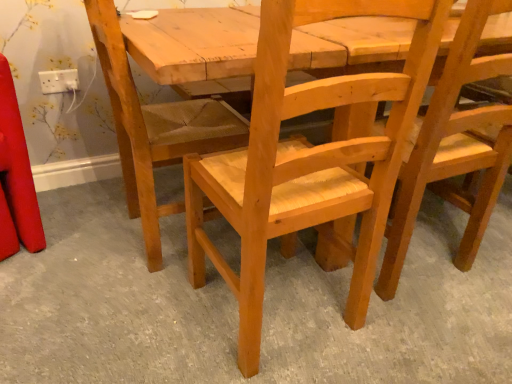
Image resolution: width=512 pixels, height=384 pixels. I want to click on natural wood chair at center, which is the second chair in right-to-left order, so click(x=308, y=161).

The image size is (512, 384). What do you see at coordinates (237, 307) in the screenshot? I see `natural wood chair at center` at bounding box center [237, 307].

Where is `natural wood chair at center, which ranks as the third chair in left-to-right order`? natural wood chair at center, which ranks as the third chair in left-to-right order is located at coordinates (453, 149).

Would you say white plastic socket at upper left is a long distance from natural wood chair at center, which ranks as the third chair in left-to-right order?

Absolutely, white plastic socket at upper left is distant from natural wood chair at center, which ranks as the third chair in left-to-right order.

Can you confirm if white plastic socket at upper left is bigger than natural wood chair at center, the 1th chair viewed from the right?

No.

Considering the positions of objects white plastic socket at upper left and natural wood chair at center, which ranks as the third chair in left-to-right order, in the image provided, who is more to the right, white plastic socket at upper left or natural wood chair at center, which ranks as the third chair in left-to-right order,?

Positioned to the right is natural wood chair at center, which ranks as the third chair in left-to-right order.

Which point is more distant from viewer, (74, 72) or (421, 127)?

The point (74, 72) is behind.

Can you confirm if natural wood chair at center, marked as the 1th chair in a left-to-right arrangement, is bigger than white plastic socket at upper left?

Indeed, natural wood chair at center, marked as the 1th chair in a left-to-right arrangement, has a larger size compared to white plastic socket at upper left.

Is white plastic socket at upper left at the back of natural wood chair at center, marked as the 1th chair in a left-to-right arrangement?

No, natural wood chair at center, marked as the 1th chair in a left-to-right arrangement,'s orientation is not away from white plastic socket at upper left.

Does point (167, 213) come closer to viewer compared to point (77, 76)?

Yes, it is.

Is white plastic socket at upper left bigger or smaller than natural wood chair at center, the second chair when ordered from left to right?

white plastic socket at upper left is smaller than natural wood chair at center, the second chair when ordered from left to right.

In terms of height, does white plastic socket at upper left look taller or shorter compared to natural wood chair at center, which is the second chair in right-to-left order?

In the image, white plastic socket at upper left appears to be shorter than natural wood chair at center, which is the second chair in right-to-left order.

From the image's perspective, who appears lower, white plastic socket at upper left or natural wood chair at center, the second chair when ordered from left to right?

natural wood chair at center, the second chair when ordered from left to right, appears lower in the image.

Between natural wood chair at center, which is the second chair in right-to-left order, and natural wood chair at center, which one is positioned behind?

natural wood chair at center is further from the camera.

Considering the sizes of objects natural wood chair at center, which is the second chair in right-to-left order, and natural wood chair at center in the image provided, who is smaller, natural wood chair at center, which is the second chair in right-to-left order, or natural wood chair at center?

Smaller between the two is natural wood chair at center, which is the second chair in right-to-left order.

The image size is (512, 384). I want to click on concrete behind the natural wood chair at center, which is the second chair in right-to-left order, so 237,307.

From the image's perspective, who appears lower, natural wood chair at center, the second chair when ordered from left to right, or natural wood chair at center?

natural wood chair at center, from the image's perspective.

From a real-world perspective, between natural wood chair at center, which is the second chair in right-to-left order, and natural wood chair at center, the third chair positioned from the right, who is vertically higher?

natural wood chair at center, which is the second chair in right-to-left order.

Considering the sizes of natural wood chair at center, which is the second chair in right-to-left order, and natural wood chair at center, marked as the 1th chair in a left-to-right arrangement, in the image, is natural wood chair at center, which is the second chair in right-to-left order, taller or shorter than natural wood chair at center, marked as the 1th chair in a left-to-right arrangement,?

In the image, natural wood chair at center, which is the second chair in right-to-left order, appears to be taller than natural wood chair at center, marked as the 1th chair in a left-to-right arrangement.

Does natural wood chair at center, which is the second chair in right-to-left order, touch natural wood chair at center, the third chair positioned from the right?

No.

Measure the distance between natural wood chair at center, the second chair when ordered from left to right, and natural wood chair at center, the third chair positioned from the right.

natural wood chair at center, the second chair when ordered from left to right, is 11.32 inches from natural wood chair at center, the third chair positioned from the right.

Does natural wood chair at center, the 1th chair viewed from the right, turn towards natural wood chair at center, the second chair when ordered from left to right?

No, natural wood chair at center, the 1th chair viewed from the right, is not aimed at natural wood chair at center, the second chair when ordered from left to right.

From the image's perspective, relative to natural wood chair at center, the second chair when ordered from left to right, is natural wood chair at center, which ranks as the third chair in left-to-right order, above or below?

natural wood chair at center, which ranks as the third chair in left-to-right order, is situated higher than natural wood chair at center, the second chair when ordered from left to right, in the image.

Considering the sizes of natural wood chair at center, the 1th chair viewed from the right, and natural wood chair at center, the second chair when ordered from left to right, in the image, is natural wood chair at center, the 1th chair viewed from the right, bigger or smaller than natural wood chair at center, the second chair when ordered from left to right,?

natural wood chair at center, the 1th chair viewed from the right, is smaller than natural wood chair at center, the second chair when ordered from left to right.

From a real-world perspective, does natural wood chair at center, the 1th chair viewed from the right, sit lower than natural wood chair at center, the second chair when ordered from left to right?

Indeed, from a real-world perspective, natural wood chair at center, the 1th chair viewed from the right, is positioned beneath natural wood chair at center, the second chair when ordered from left to right.

From the image's perspective, would you say natural wood chair at center, the second chair when ordered from left to right, is positioned over white plastic socket at upper left?

No.

Between natural wood chair at center, the second chair when ordered from left to right, and white plastic socket at upper left, which one has smaller width?

With smaller width is white plastic socket at upper left.

Measure the distance from natural wood chair at center, the second chair when ordered from left to right, to white plastic socket at upper left.

natural wood chair at center, the second chair when ordered from left to right, is 1.17 meters away from white plastic socket at upper left.

Is natural wood chair at center, which is the second chair in right-to-left order, taller than white plastic socket at upper left?

Yes.

I want to click on the 3rd chair to the right of the white plastic socket at upper left, counting from the anchor's position, so click(x=453, y=149).

Find the location of a particular element. The width and height of the screenshot is (512, 384). chair that is the 3rd one below the white plastic socket at upper left (from a real-world perspective) is located at coordinates (155, 120).

Which object lies nearer to the anchor point natural wood chair at center, the 1th chair viewed from the right, natural wood chair at center, the third chair positioned from the right, or natural wood chair at center?

natural wood chair at center is closer to natural wood chair at center, the 1th chair viewed from the right.

When comparing their distances from natural wood chair at center, the third chair positioned from the right, does natural wood chair at center, which ranks as the third chair in left-to-right order, or natural wood chair at center, the second chair when ordered from left to right, seem further?

natural wood chair at center, which ranks as the third chair in left-to-right order.

Estimate the real-world distances between objects in this image. Which object is closer to white plastic socket at upper left, natural wood chair at center, marked as the 1th chair in a left-to-right arrangement, or natural wood chair at center, which is the second chair in right-to-left order?

natural wood chair at center, marked as the 1th chair in a left-to-right arrangement.

Based on their spatial positions, is natural wood chair at center, the 1th chair viewed from the right, or natural wood chair at center closer to natural wood chair at center, marked as the 1th chair in a left-to-right arrangement?

The object closer to natural wood chair at center, marked as the 1th chair in a left-to-right arrangement, is natural wood chair at center.

From the image, which object appears to be nearer to natural wood chair at center, the second chair when ordered from left to right, natural wood chair at center, which ranks as the third chair in left-to-right order, or natural wood chair at center?

The object closer to natural wood chair at center, the second chair when ordered from left to right, is natural wood chair at center, which ranks as the third chair in left-to-right order.

Looking at the image, which one is located closer to white plastic socket at upper left, natural wood chair at center, the 1th chair viewed from the right, or natural wood chair at center, the second chair when ordered from left to right?

natural wood chair at center, the second chair when ordered from left to right, is positioned closer to the anchor white plastic socket at upper left.

From the picture: Which object lies further to the anchor point natural wood chair at center, white plastic socket at upper left or natural wood chair at center, marked as the 1th chair in a left-to-right arrangement?

Based on the image, white plastic socket at upper left appears to be further to natural wood chair at center.

Which object lies further to the anchor point white plastic socket at upper left, natural wood chair at center, the second chair when ordered from left to right, or natural wood chair at center, marked as the 1th chair in a left-to-right arrangement?

Based on the image, natural wood chair at center, the second chair when ordered from left to right, appears to be further to white plastic socket at upper left.

This screenshot has width=512, height=384. In order to click on concrete situated between natural wood chair at center, the second chair when ordered from left to right, and natural wood chair at center, the 1th chair viewed from the right, from left to right in this screenshot , I will do `click(237, 307)`.

This screenshot has height=384, width=512. Find the location of `chair between natural wood chair at center, marked as the 1th chair in a left-to-right arrangement, and natural wood chair at center`. chair between natural wood chair at center, marked as the 1th chair in a left-to-right arrangement, and natural wood chair at center is located at coordinates (308, 161).

Where is `concrete between natural wood chair at center, the third chair positioned from the right, and natural wood chair at center, the 1th chair viewed from the right, in the horizontal direction`? concrete between natural wood chair at center, the third chair positioned from the right, and natural wood chair at center, the 1th chair viewed from the right, in the horizontal direction is located at coordinates (237, 307).

At what (x,y) coordinates should I click in order to perform the action: click on chair situated between natural wood chair at center, marked as the 1th chair in a left-to-right arrangement, and natural wood chair at center, the 1th chair viewed from the right, from left to right. Please return your answer as a coordinate pair (x, y). This screenshot has width=512, height=384. Looking at the image, I should click on (308, 161).